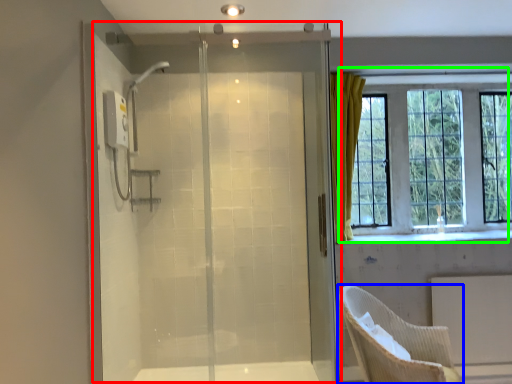
Question: Based on their relative distances, which object is farther from screen door (highlighted by a red box)? Choose from chair (highlighted by a blue box) and window (highlighted by a green box).

Choices:
 (A) chair
 (B) window

Answer: (B)